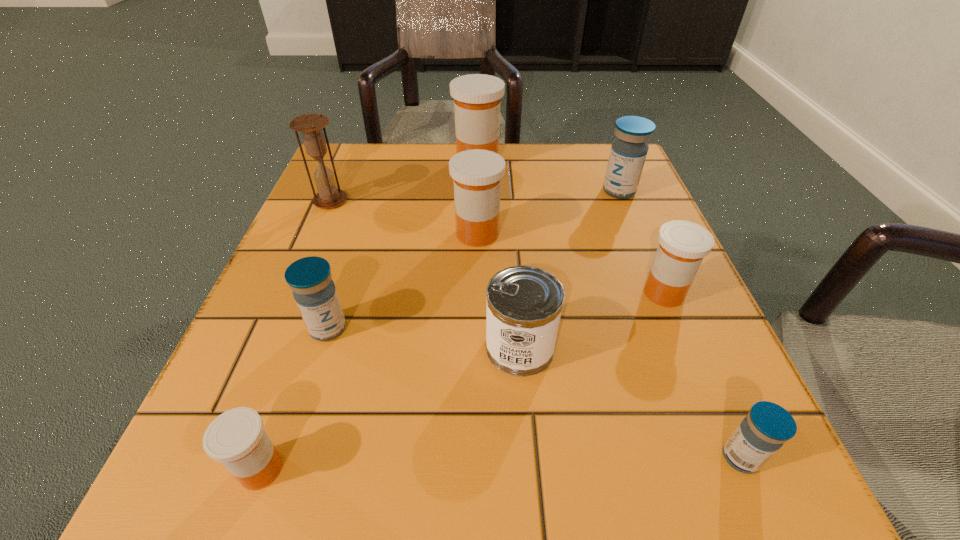
Locate an element on the screen. free point located 0.130m on the label of the second smallest orange medicine is located at coordinates (562, 293).

Locate an element on the screen. This screenshot has width=960, height=540. free space located on the label of the second smallest orange medicine is located at coordinates (421, 293).

Locate an element on the screen. The height and width of the screenshot is (540, 960). vacant region located on the right of the second nearest blue medicine is located at coordinates (446, 328).

You are a GUI agent. You are given a task and a screenshot of the screen. Output one action in this format:
    pyautogui.click(x=<x>, y=<y>)
    Task: Click on the free location located 0.260m on the left of the can
    This screenshot has height=540, width=960.
    Given the screenshot: What is the action you would take?
    pyautogui.click(x=307, y=347)

Where is `free space located 0.070m on the back of the nearest blue medicine`? Image resolution: width=960 pixels, height=540 pixels. free space located 0.070m on the back of the nearest blue medicine is located at coordinates (711, 390).

You are a GUI agent. You are given a task and a screenshot of the screen. Output one action in this format:
    pyautogui.click(x=<x>, y=<y>)
    Task: Click on the free location located on the label of the leftmost orange medicine
    The image size is (960, 540).
    Given the screenshot: What is the action you would take?
    pyautogui.click(x=617, y=469)

The width and height of the screenshot is (960, 540). I want to click on hourglass situated at the far edge, so coord(310,125).

Where is `hourglass that is at the left edge`? hourglass that is at the left edge is located at coordinates (310, 125).

Identify the location of object that is at the far left corner. (310, 125).

You are a GUI agent. You are given a task and a screenshot of the screen. Output one action in this format:
    pyautogui.click(x=<x>, y=<y>)
    Task: Click on the object located at the near left corner
    This screenshot has width=960, height=540.
    Given the screenshot: What is the action you would take?
    pyautogui.click(x=236, y=438)